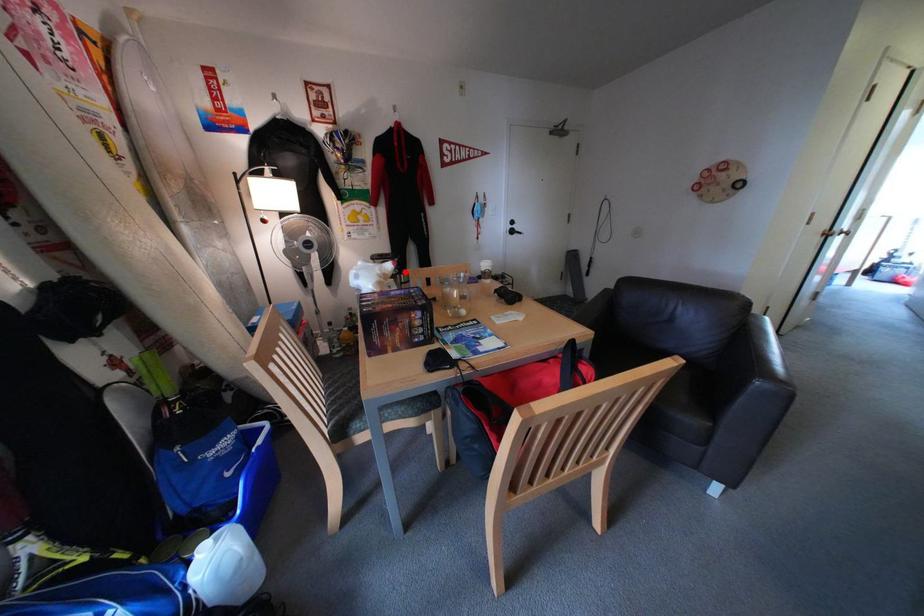
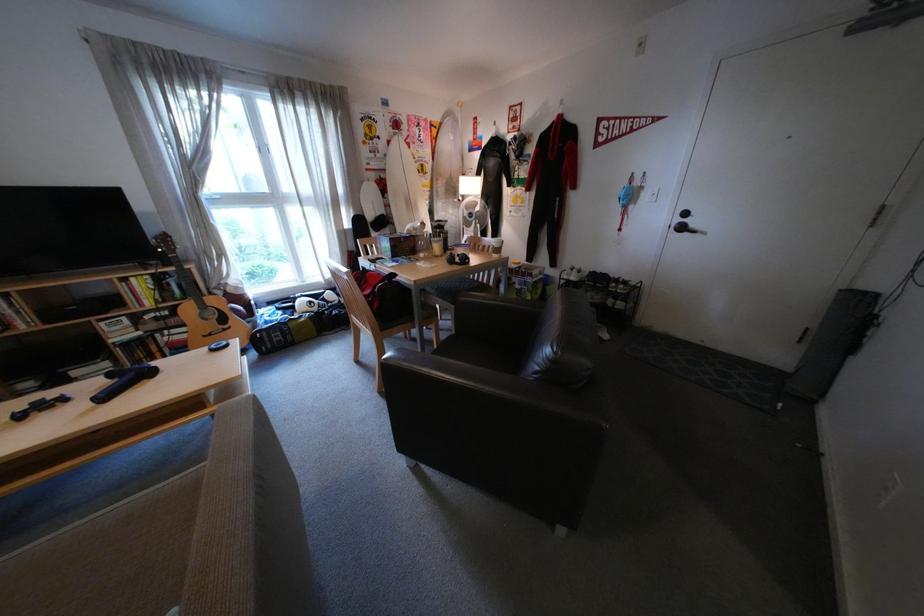
Where in the second image is the point corresponding to the highlighted location from the first image?

(433, 228)